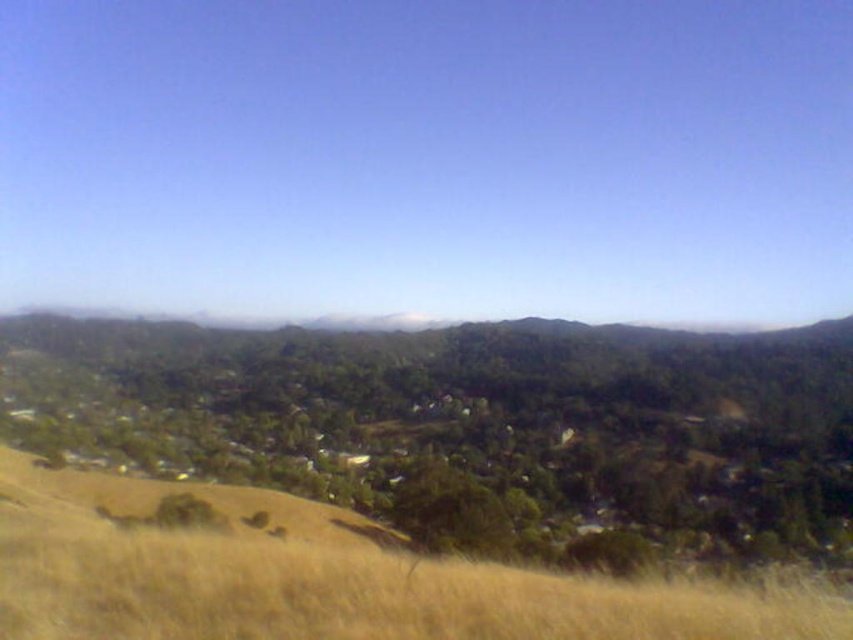
You are planning to set up a tent for a camping trip. You see the dry grass at lower center and the white fluffy cloud at center. Which area would be more suitable for setting up the tent based on their widths?

The white fluffy cloud at center is wider than the dry grass at lower center, so the area with the dry grass at lower center would be more suitable for setting up the tent since it requires less space.

You are standing at the center of the image and want to place a small flag exactly at the dry grass at lower center. What are the coordinates where you should place the flag?

The coordinates for placing the flag at the dry grass at lower center are at point (323, 577).

You are standing at the point marked by the coordinates point [323,577] in the image. Looking around, what type of terrain are you currently on?

The point [323,577] is labeled as dry grass at lower center, so you are standing on dry grass terrain.